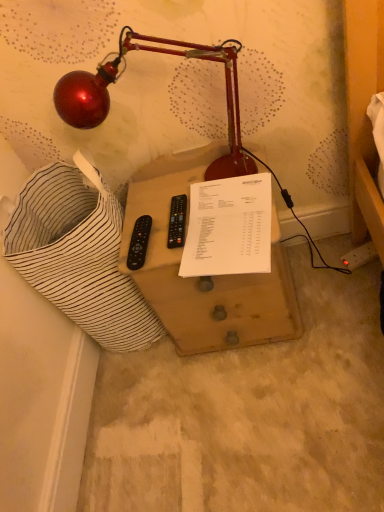
Identify the location of free point to the left of wooden drawer at center. Image resolution: width=384 pixels, height=512 pixels. (148, 406).